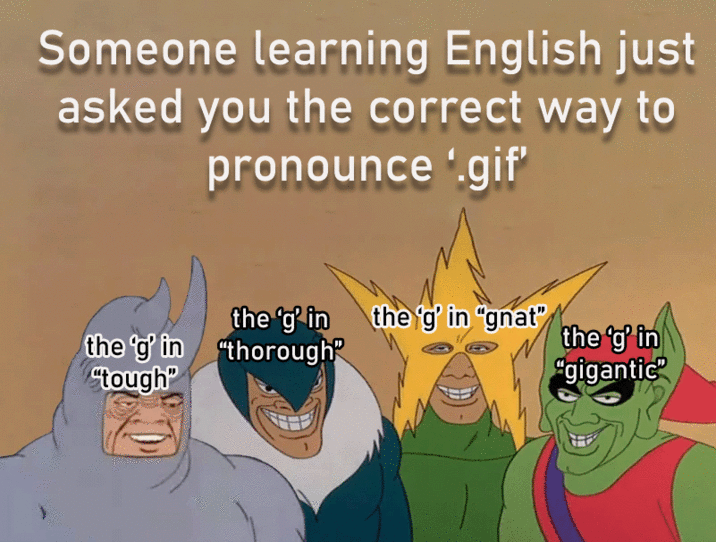
Locate an element on the screen. wall is located at coordinates (104, 249).